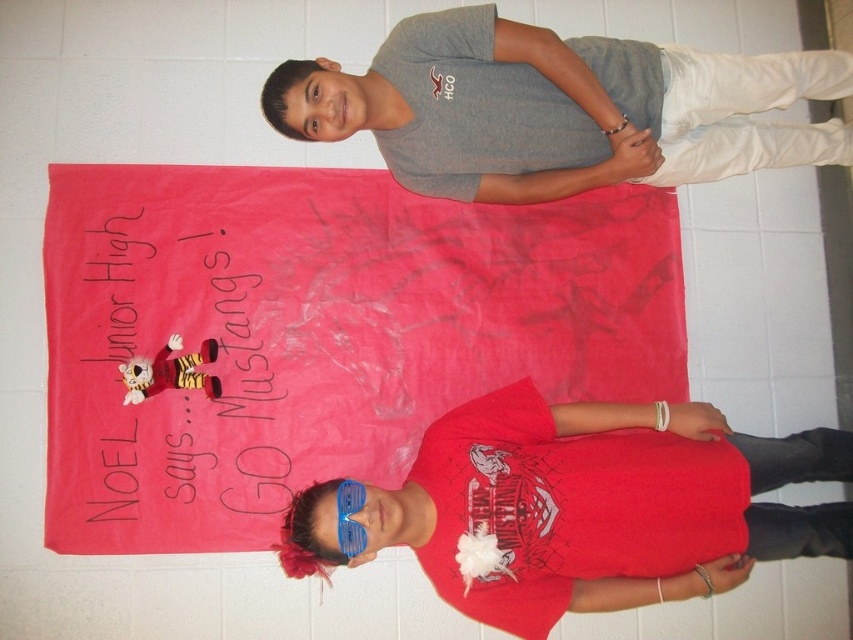
Is pink paper at upper center above gray cotton t-shirt at upper center?

Incorrect, pink paper at upper center is not positioned above gray cotton t-shirt at upper center.

Image resolution: width=853 pixels, height=640 pixels. Describe the element at coordinates (318, 333) in the screenshot. I see `pink paper at upper center` at that location.

Is point (456, 330) positioned before point (573, 164)?

No, (456, 330) is further to viewer.

This screenshot has width=853, height=640. I want to click on pink paper at upper center, so click(318, 333).

Is handwritten paper at center above blue plastic goggles at center?

Yes, handwritten paper at center is above blue plastic goggles at center.

Based on the photo, between handwritten paper at center and blue plastic goggles at center, which one has less height?

blue plastic goggles at center

Where is `handwritten paper at center`? handwritten paper at center is located at coordinates (180, 369).

Is point (479, 417) farther from viewer compared to point (105, 436)?

That is False.

Can you confirm if shiny blue sunglasses at center is positioned to the left of handwritten paper at center?

No, shiny blue sunglasses at center is not to the left of handwritten paper at center.

Between point (815, 524) and point (111, 246), which one is positioned in front?

Positioned in front is point (111, 246).

Where is `shiny blue sunglasses at center`? shiny blue sunglasses at center is located at coordinates (585, 506).